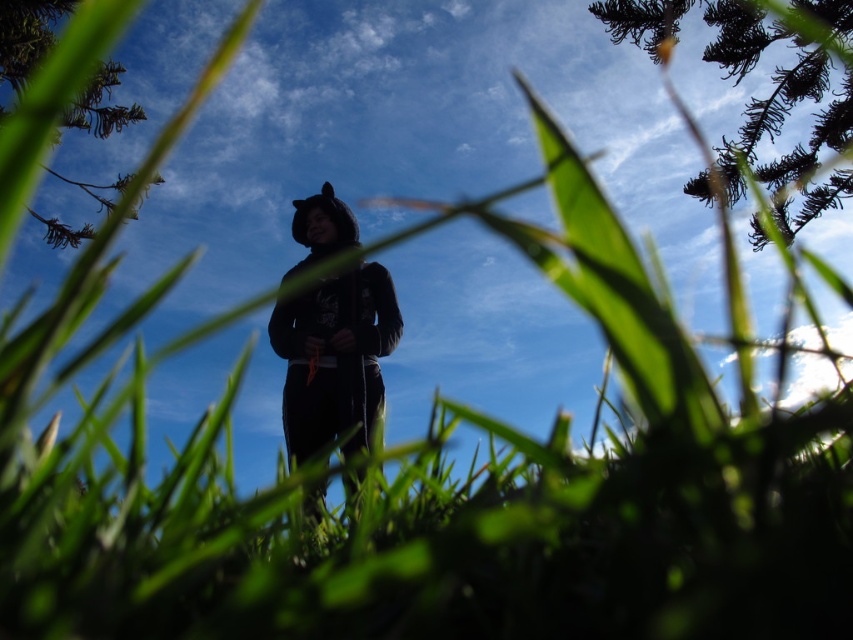
You are a photographer trying to capture a clear shot of the black matte hoodie at center without any obstructions. Is the green leafy tree at upper left blocking your view of the hoodie?

The black matte hoodie at center is in front of the green leafy tree at upper left, so the tree is behind the hoodie and does not block the view.

You are standing in a grassy area looking up at a person. There are two points marked in the scene. The first point is at coordinates point (799, 45) and the second is at point (56, 17). Which point is closer to you?

Point (799, 45) is closer to the viewer than point (56, 17).

You are a photographer trying to capture the entire scene in one shot. Given that the dark green textured pine branch at upper right and the green leafy tree at upper left are both in your viewfinder, which object would you need to adjust your camera angle to avoid cropping?

You should adjust your camera angle to avoid cropping the dark green textured pine branch at upper right because it is wider than the green leafy tree at upper left.